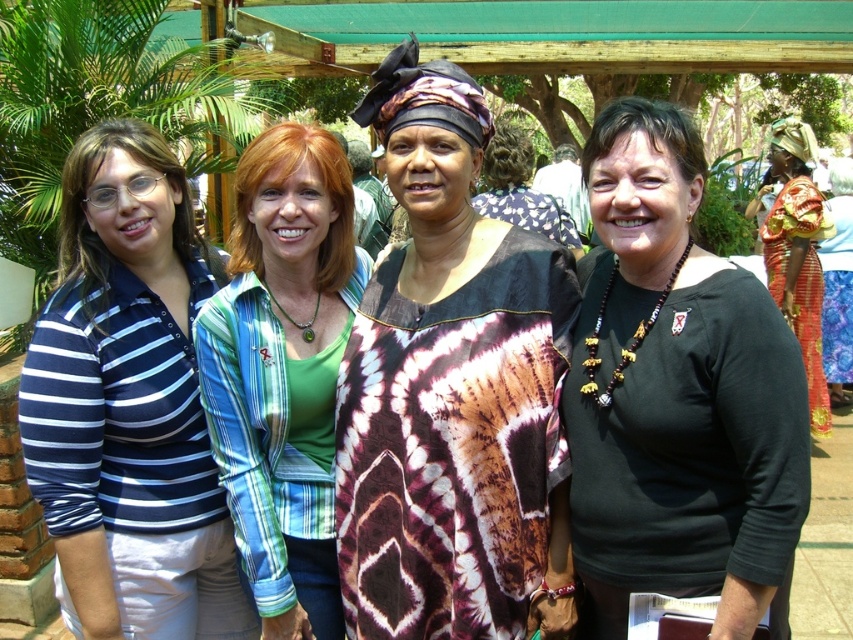
In order to click on blue striped polo shirt at left in this screenshot , I will do `click(128, 403)`.

Can you confirm if blue striped polo shirt at left is shorter than shiny red fabric at right?

Yes, blue striped polo shirt at left is shorter than shiny red fabric at right.

Image resolution: width=853 pixels, height=640 pixels. Find the location of `blue striped polo shirt at left`. blue striped polo shirt at left is located at coordinates (128, 403).

Between printed fabric dress at center and shiny red fabric at right, which one has more height?

With more height is shiny red fabric at right.

The height and width of the screenshot is (640, 853). Identify the location of printed fabric dress at center. (451, 392).

Where is `printed fabric dress at center`? printed fabric dress at center is located at coordinates (451, 392).

How much distance is there between printed fabric dress at center and green plaid shirt at center?

printed fabric dress at center is 15.13 inches away from green plaid shirt at center.

Which is behind, point (363, 371) or point (280, 362)?

The point (280, 362) is behind.

Between point (502, 237) and point (248, 435), which one is positioned behind?

The point (248, 435) is more distant.

Where is `printed fabric dress at center`? printed fabric dress at center is located at coordinates pyautogui.click(x=451, y=392).